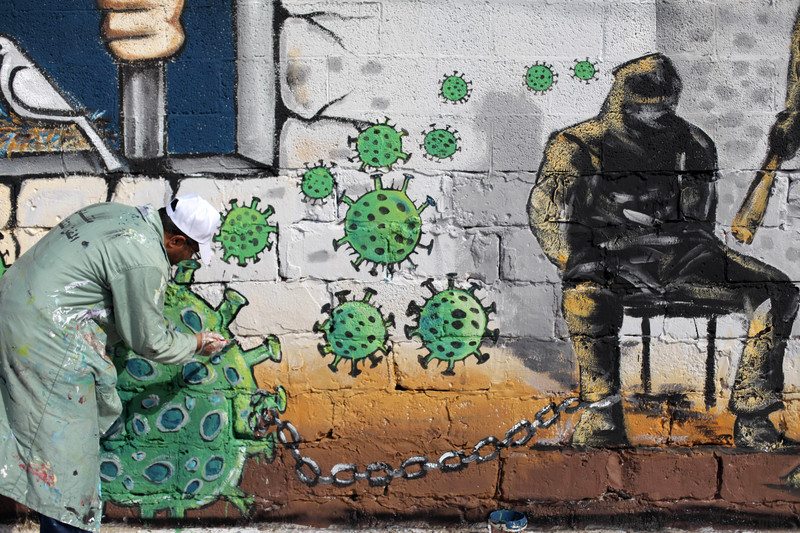
Image resolution: width=800 pixels, height=533 pixels. What are the coordinates of `blue bowl` in the screenshot? It's located at (516, 523).